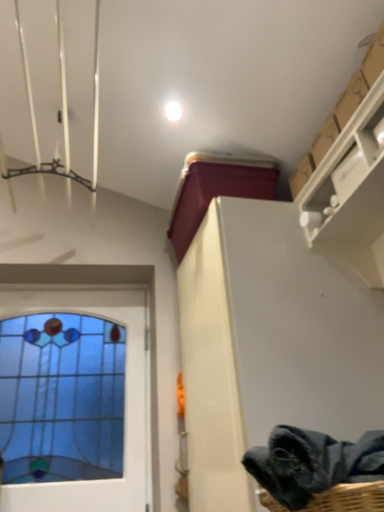
Question: From a real-world perspective, does white glossy droplight at upper center stand above stained glass window at left?

Choices:
 (A) yes
 (B) no

Answer: (A)

Question: Is white glossy droplight at upper center facing towards stained glass window at left?

Choices:
 (A) no
 (B) yes

Answer: (A)

Question: Does white glossy droplight at upper center come in front of stained glass window at left?

Choices:
 (A) no
 (B) yes

Answer: (A)

Question: Can you confirm if white glossy droplight at upper center is bigger than stained glass window at left?

Choices:
 (A) yes
 (B) no

Answer: (B)

Question: Is white glossy droplight at upper center smaller than stained glass window at left?

Choices:
 (A) no
 (B) yes

Answer: (B)

Question: Does white glossy droplight at upper center appear on the left side of stained glass window at left?

Choices:
 (A) yes
 (B) no

Answer: (B)

Question: Does cardboard at upper right have a greater height compared to stained glass window at left?

Choices:
 (A) no
 (B) yes

Answer: (A)

Question: Is cardboard at upper right oriented away from stained glass window at left?

Choices:
 (A) no
 (B) yes

Answer: (A)

Question: Is the surface of cardboard at upper right in direct contact with stained glass window at left?

Choices:
 (A) yes
 (B) no

Answer: (B)

Question: Is cardboard at upper right outside stained glass window at left?

Choices:
 (A) no
 (B) yes

Answer: (B)

Question: Considering the relative sizes of cardboard at upper right and stained glass window at left in the image provided, is cardboard at upper right wider than stained glass window at left?

Choices:
 (A) yes
 (B) no

Answer: (A)

Question: From the image's perspective, does cardboard at upper right appear lower than stained glass window at left?

Choices:
 (A) no
 (B) yes

Answer: (A)

Question: Is white glossy droplight at upper center surrounded by dark gray fabric at lower right?

Choices:
 (A) no
 (B) yes

Answer: (A)